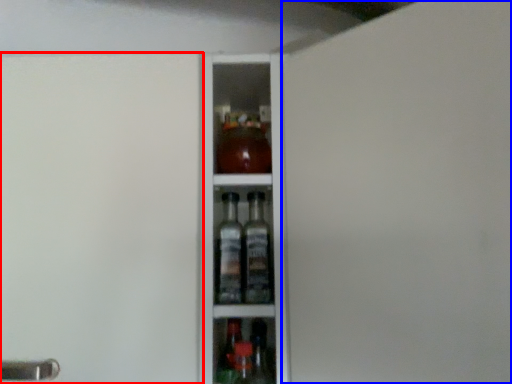
Question: Which object appears farthest to the camera in this image, screen door (highlighted by a red box) or screen door (highlighted by a blue box)?

Choices:
 (A) screen door
 (B) screen door

Answer: (A)